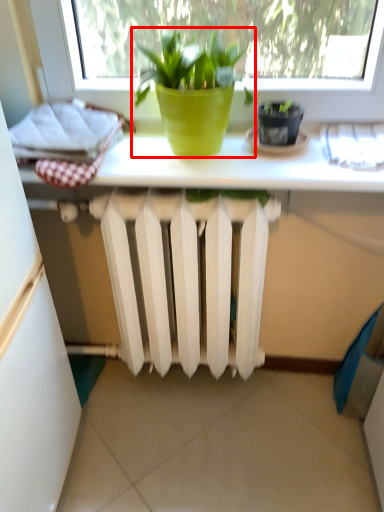
Question: From the image's perspective, what is the correct spatial relationship of houseplant (annotated by the red box) in relation to flowerpot?

Choices:
 (A) below
 (B) above

Answer: (B)